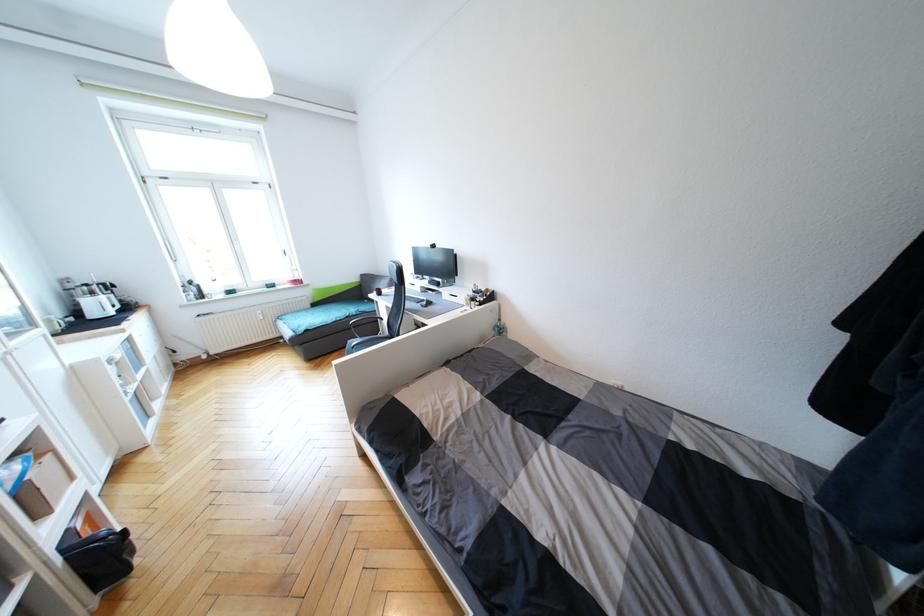
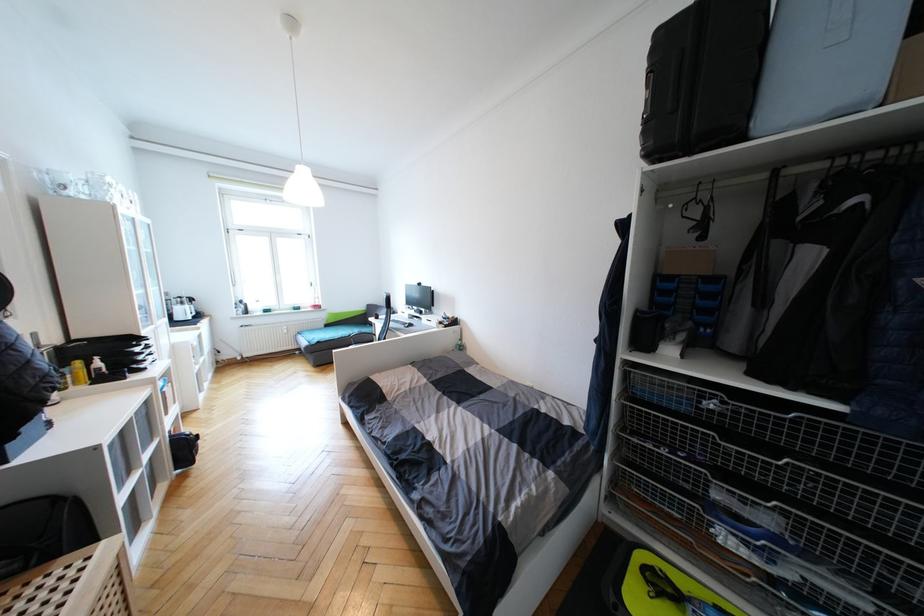
Locate, in the second image, the point that corresponds to (95,294) in the first image.

(186, 305)